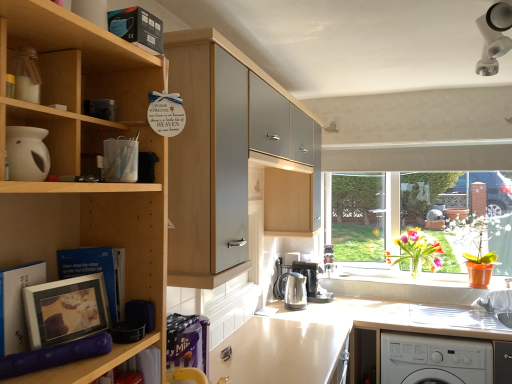
Question: Is vibrant glass vase at window wider than orange plastic pot at window?

Choices:
 (A) yes
 (B) no

Answer: (B)

Question: Is vibrant glass vase at window facing towards orange plastic pot at window?

Choices:
 (A) yes
 (B) no

Answer: (B)

Question: Is vibrant glass vase at window far away from orange plastic pot at window?

Choices:
 (A) yes
 (B) no

Answer: (B)

Question: Does vibrant glass vase at window lie in front of orange plastic pot at window?

Choices:
 (A) yes
 (B) no

Answer: (B)

Question: From the image's perspective, is vibrant glass vase at window on orange plastic pot at window?

Choices:
 (A) no
 (B) yes

Answer: (A)

Question: Can you confirm if vibrant glass vase at window is positioned to the left of orange plastic pot at window?

Choices:
 (A) no
 (B) yes

Answer: (B)

Question: From a real-world perspective, is wooden cabinet at upper center positioned under white plastic washing machine at lower right based on gravity?

Choices:
 (A) yes
 (B) no

Answer: (B)

Question: Is wooden cabinet at upper center surrounding white plastic washing machine at lower right?

Choices:
 (A) no
 (B) yes

Answer: (A)

Question: From a real-world perspective, is wooden cabinet at upper center positioned over white plastic washing machine at lower right based on gravity?

Choices:
 (A) no
 (B) yes

Answer: (B)

Question: Can you confirm if wooden cabinet at upper center is positioned to the right of white plastic washing machine at lower right?

Choices:
 (A) yes
 (B) no

Answer: (B)

Question: Is wooden cabinet at upper center further to the viewer compared to white plastic washing machine at lower right?

Choices:
 (A) no
 (B) yes

Answer: (A)

Question: Is the position of wooden cabinet at upper center less distant than that of white plastic washing machine at lower right?

Choices:
 (A) no
 (B) yes

Answer: (B)

Question: Is light brown laminate counter top at center positioned with its back to orange plastic pot at window?

Choices:
 (A) yes
 (B) no

Answer: (B)